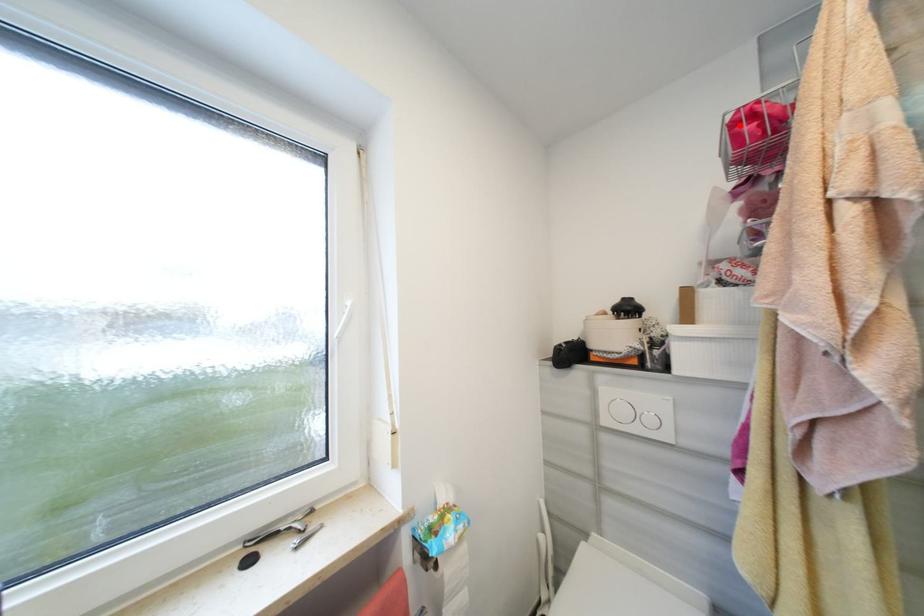
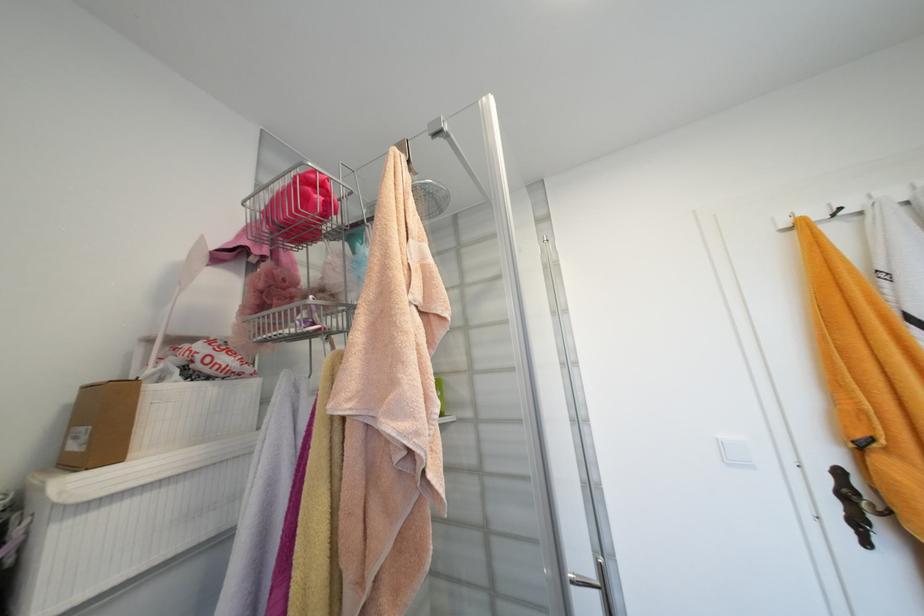
Where in the second image is the point corresponding to the highlighted location from the first image?

(312, 182)